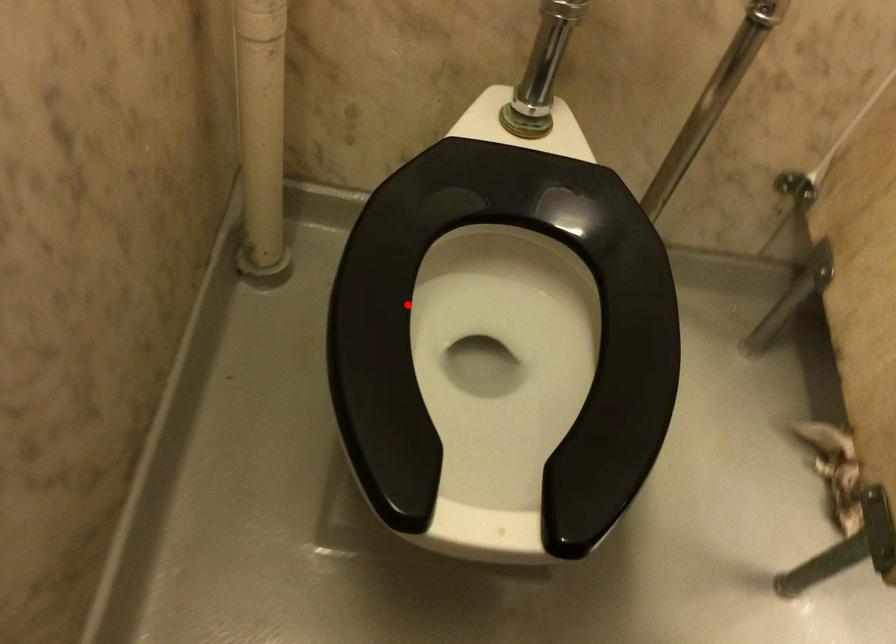
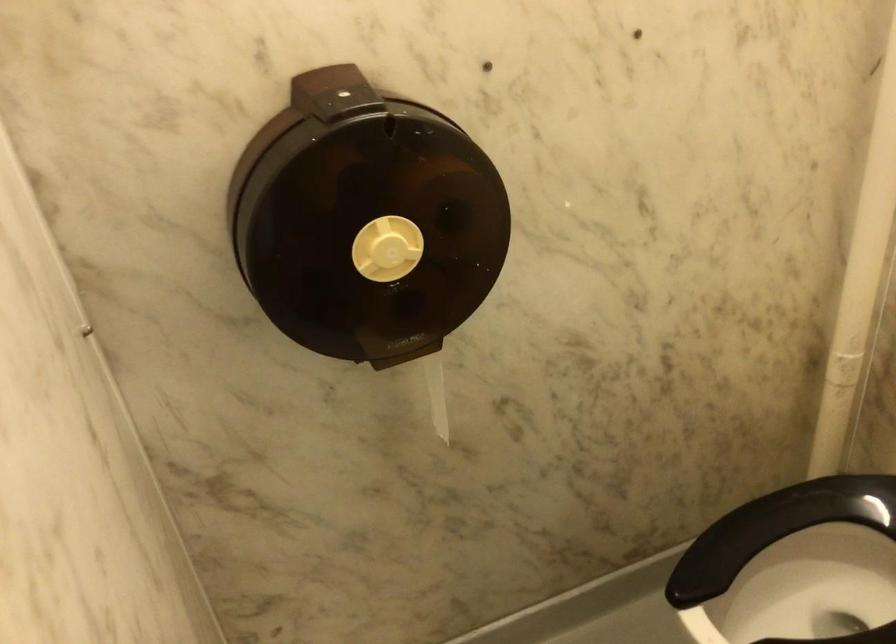
Question: I am providing you with two images of the same scene from different viewpoints. Image1 has a red point marked. In image2, the corresponding 3D location appears at what relative position? Reply with the corresponding letter.

Choices:
 (A) Closer
 (B) Farther

Answer: (B)